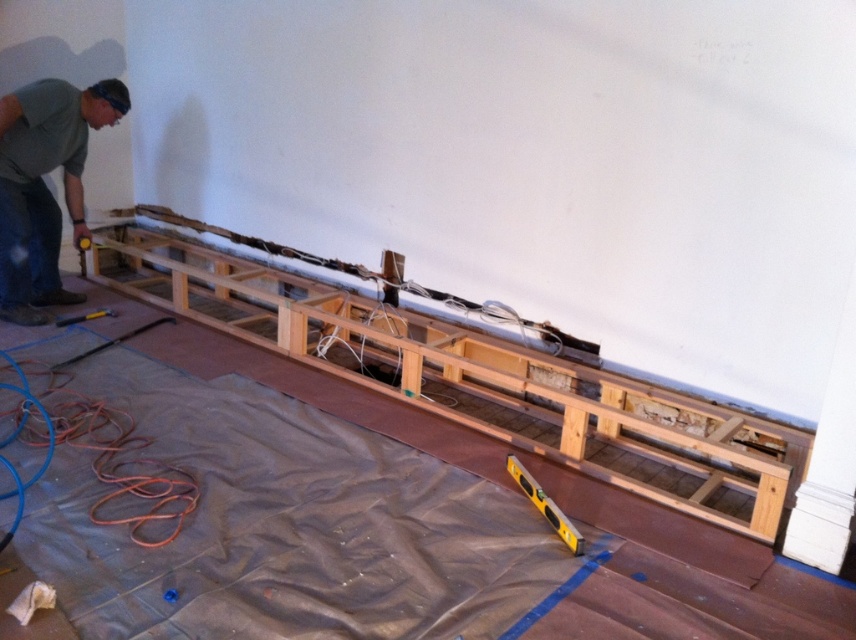
You are a contractor working on this construction site. You need to place a metallic silver hammer at lower left next to the natural wood frame at center. Will the hammer fit next to the frame without overlapping it?

The natural wood frame at center is wider than the metallic silver hammer at lower left, so there should be enough space to place the hammer next to the frame without overlapping.

You are an inspector checking the construction site. You notice the green matte shirt at left and the yellow plastic level at center. Which object takes up more space in the scene?

The green matte shirt at left is bigger than the yellow plastic level at center, so it takes up more space in the scene.